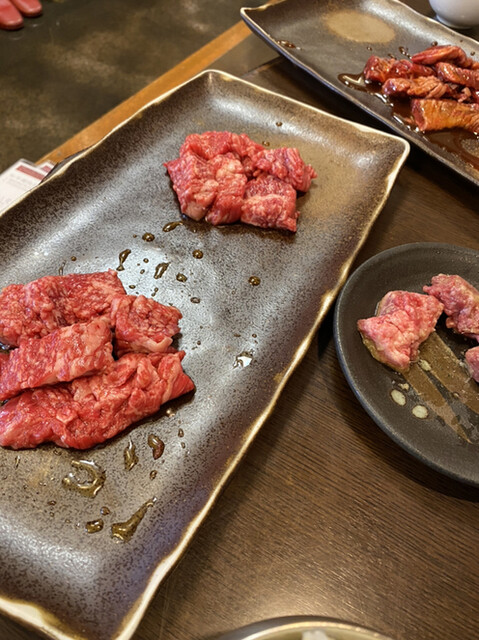
Where is `retangular platter`? This screenshot has width=479, height=640. retangular platter is located at coordinates (152, 588).